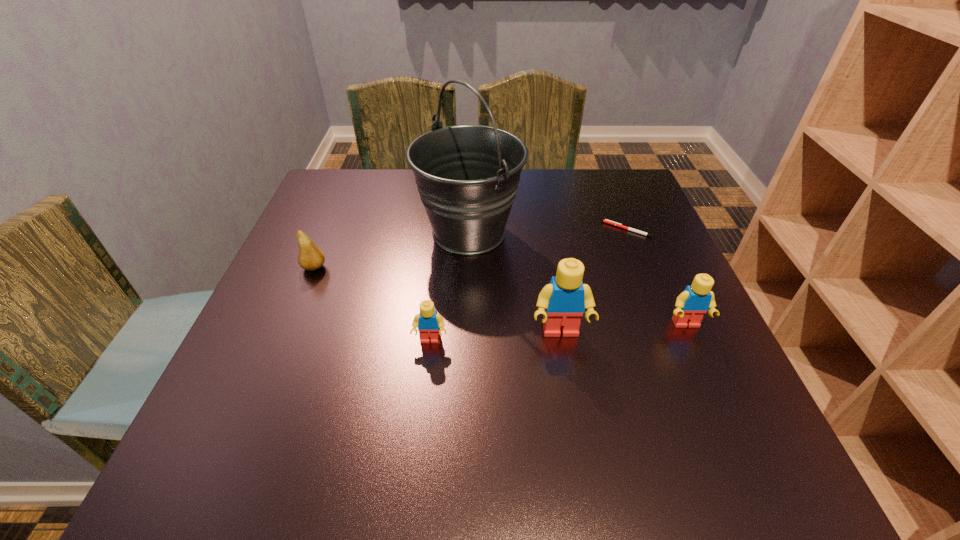
You are a GUI agent. You are given a task and a screenshot of the screen. Output one action in this format:
    pyautogui.click(x=<x>, y=<y>)
    Task: Click on the vacant space that's between the second shortest Lego and the second Lego from right to left
    
    Given the screenshot: What is the action you would take?
    pyautogui.click(x=623, y=329)

The image size is (960, 540). I want to click on vacant space that's between the leftmost Lego and the tallest object, so [449, 287].

Locate an element on the screen. Image resolution: width=960 pixels, height=540 pixels. blank region between the shortest Lego and the pen is located at coordinates (529, 285).

Locate an element on the screen. free space between the tallest Lego and the tallest object is located at coordinates (515, 283).

You are a GUI agent. You are given a task and a screenshot of the screen. Output one action in this format:
    pyautogui.click(x=<x>, y=<y>)
    Task: Click on the free space between the bucket and the leftmost Lego
    Image resolution: width=960 pixels, height=540 pixels.
    Given the screenshot: What is the action you would take?
    click(x=449, y=287)

At what (x,y) coordinates should I click in order to perform the action: click on free space between the leftmost object and the bucket. Please return your answer as a coordinate pair (x, y). This screenshot has height=540, width=960. Looking at the image, I should click on (392, 250).

The height and width of the screenshot is (540, 960). I want to click on free space that is in between the leftmost Lego and the tallest object, so click(x=449, y=287).

The width and height of the screenshot is (960, 540). Identify the location of the fourth closest object relative to the tallest object. (605, 221).

Where is `object that is the third closest to the pear`? object that is the third closest to the pear is located at coordinates (562, 302).

Locate which Lego is the closest to the third tallest object. Please provide its 2D coordinates. Your answer should be formatted as a tuple, i.e. [(x, y)], where the tuple contains the x and y coordinates of a point satisfying the conditions above.

[(562, 302)]